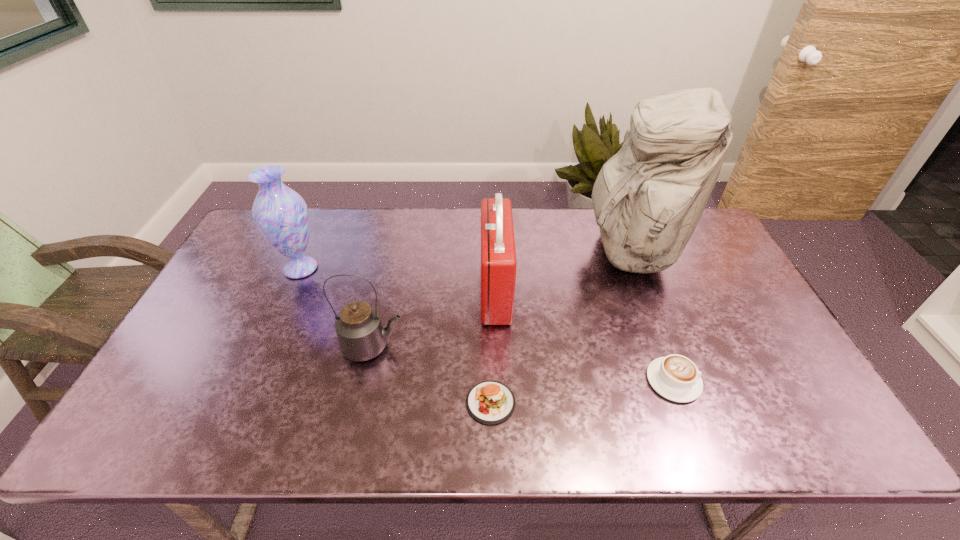
Where is `unoccupied area between the shortest object and the fifth object from right to left`? unoccupied area between the shortest object and the fifth object from right to left is located at coordinates (432, 375).

Identify the location of free space between the shortest object and the fifth tallest object. The image size is (960, 540). (582, 392).

At what (x,y) coordinates should I click in order to perform the action: click on free spot between the first-aid kit and the kettle. Please return your answer as a coordinate pair (x, y). This screenshot has width=960, height=540. Looking at the image, I should click on (435, 319).

Find the location of a particular element. The height and width of the screenshot is (540, 960). free spot between the fifth tallest object and the first-aid kit is located at coordinates (585, 335).

At what (x,y) coordinates should I click in order to perform the action: click on empty location between the first-aid kit and the kettle. Please return your answer as a coordinate pair (x, y). Looking at the image, I should click on (435, 319).

Locate an element on the screen. This screenshot has width=960, height=540. free area in between the patty (food) and the first-aid kit is located at coordinates (493, 347).

Where is `object that is the nearest to the shortest object`? Image resolution: width=960 pixels, height=540 pixels. object that is the nearest to the shortest object is located at coordinates (361, 335).

Identify which object is the closest to the tallest object. Please provide its 2D coordinates. Your answer should be formatted as a tuple, i.e. [(x, y)], where the tuple contains the x and y coordinates of a point satisfying the conditions above.

[(675, 377)]

The width and height of the screenshot is (960, 540). I want to click on vacant space that satisfies the following two spatial constraints: 1. spout on the third shortest object; 2. on the back side of the shortest object, so click(361, 402).

Identify the location of free space that satisfies the following two spatial constraints: 1. spout on the patty (food); 2. on the right side of the fourth tallest object. Image resolution: width=960 pixels, height=540 pixels. (361, 402).